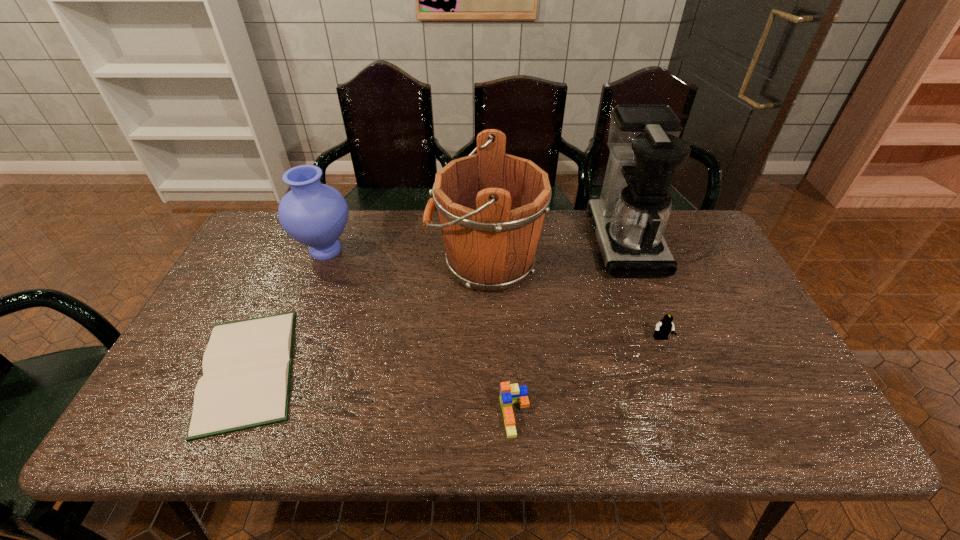
At what (x,y) coordinates should I click in order to perform the action: click on free location located at the front of the coffee maker where the controls are located. Please return your answer as a coordinate pair (x, y). This screenshot has height=540, width=960. Looking at the image, I should click on (539, 241).

Identify the location of free space located 0.170m with the handle on the side of the bucket. (374, 264).

What are the coordinates of `vacant space located 0.220m with the handle on the side of the bucket` in the screenshot? It's located at (358, 264).

Locate an element on the screen. vacant area located 0.270m with the handle on the side of the bucket is located at coordinates (342, 264).

This screenshot has height=540, width=960. I want to click on vacant space located 0.340m on the front of the third tallest object, so click(281, 366).

Find the location of a particular element. This screenshot has width=960, height=540. blank space located 0.240m on the front-facing side of the taller Lego is located at coordinates [695, 431].

This screenshot has height=540, width=960. I want to click on blank space located 0.100m on the left of the shorter Lego, so click(x=456, y=415).

This screenshot has width=960, height=540. In order to click on blank space located on the right of the hardback book in this screenshot , I will do `click(378, 369)`.

At what (x,y) coordinates should I click in order to perform the action: click on coffee maker that is at the far edge. Please return your answer as a coordinate pair (x, y). Looking at the image, I should click on (629, 219).

The width and height of the screenshot is (960, 540). Find the location of `bucket present at the far edge`. bucket present at the far edge is located at coordinates (491, 205).